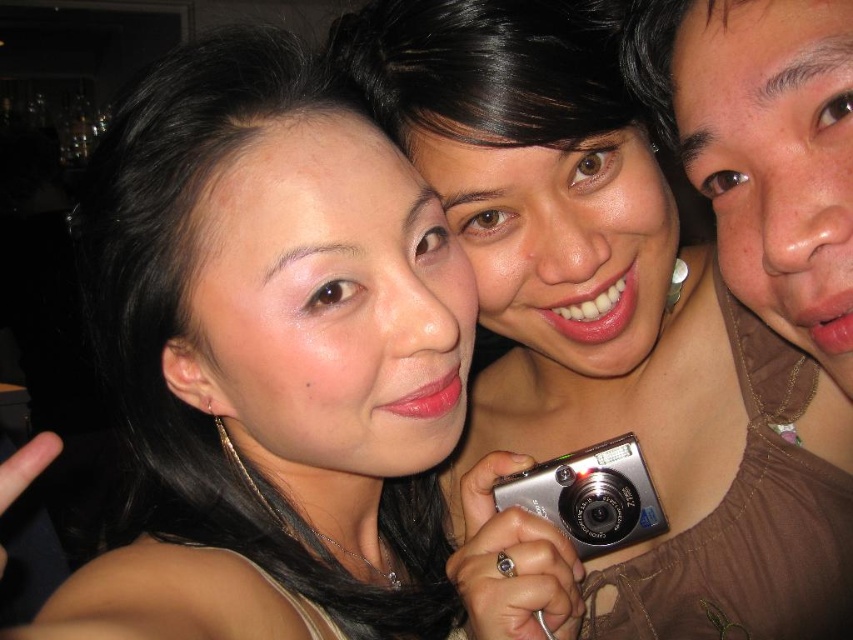
Question: Is matte brown shirt at right positioned in front of silver metallic camera at center?

Choices:
 (A) yes
 (B) no

Answer: (A)

Question: Observing the image, what is the correct spatial positioning of matte brown shirt at right in reference to silver metallic camera at center?

Choices:
 (A) left
 (B) right

Answer: (B)

Question: Which point is closer to the camera?

Choices:
 (A) (660, 84)
 (B) (621, 520)
 (C) (285, 579)

Answer: (A)

Question: Where is matte brown shirt at right located in relation to silver metallic camera at center in the image?

Choices:
 (A) below
 (B) above

Answer: (B)

Question: Estimate the real-world distances between objects in this image. Which object is farther from the silver metallic camera at center?

Choices:
 (A) matte black hair at upper center
 (B) matte brown shirt at right

Answer: (B)

Question: Estimate the real-world distances between objects in this image. Which object is farther from the silver metallic camera at center?

Choices:
 (A) matte brown shirt at right
 (B) matte black hair at upper center

Answer: (A)